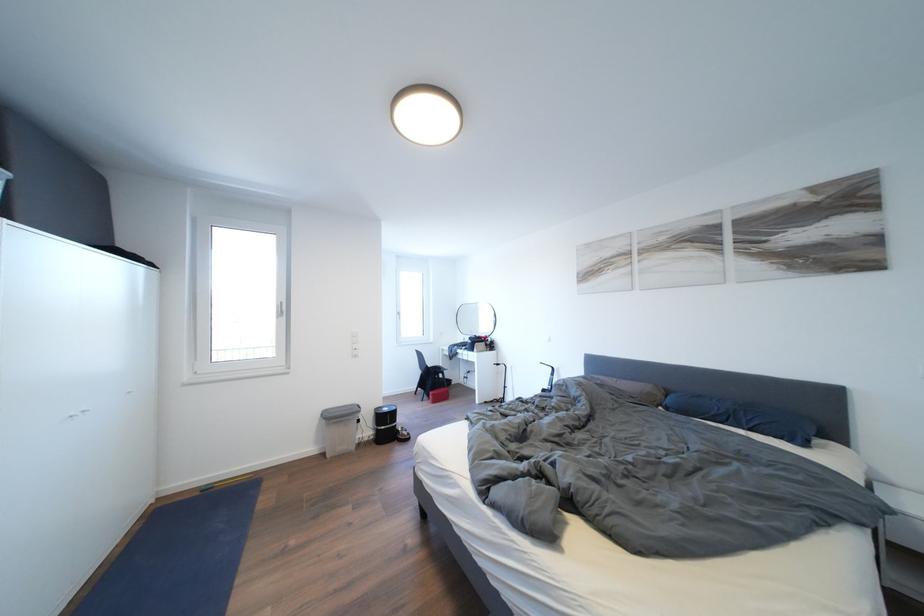
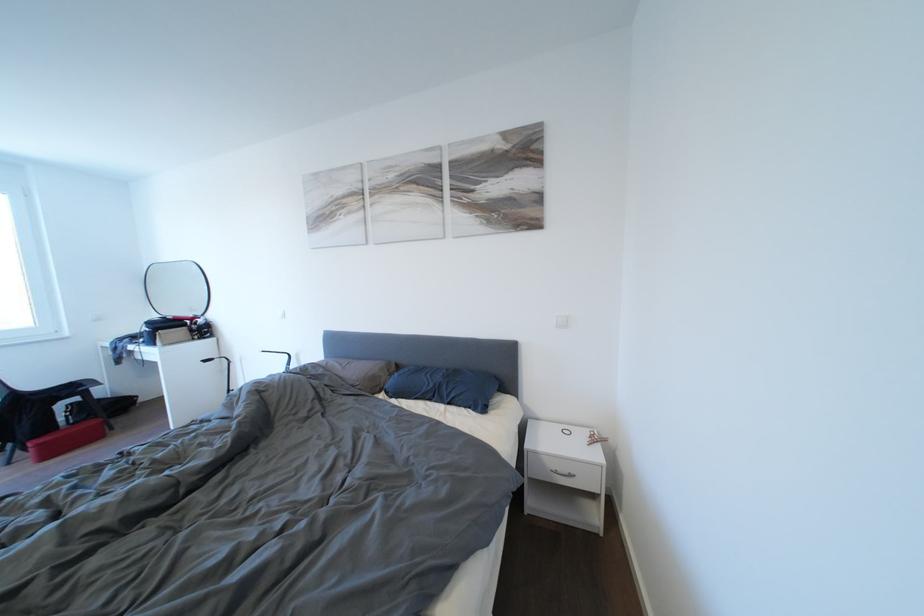
The point at (441, 400) is marked in the first image. Where is the corresponding point in the second image?

(46, 450)